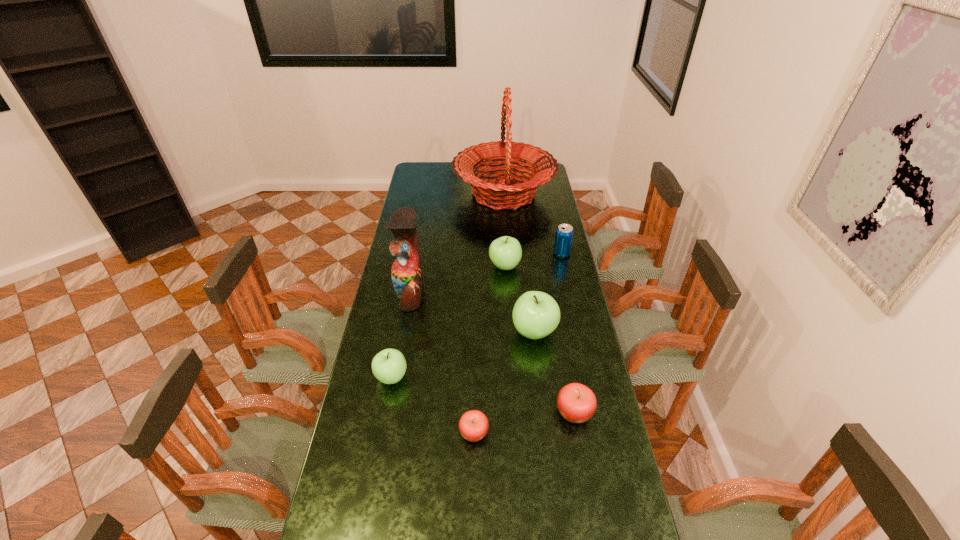
Image resolution: width=960 pixels, height=540 pixels. Identify the location of vacant position located 0.200m on the left of the smaller red apple. (393, 433).

Where is `object located in the far edge section of the desktop`? Image resolution: width=960 pixels, height=540 pixels. object located in the far edge section of the desktop is located at coordinates (504, 195).

Locate an element on the screen. The image size is (960, 540). parrot that is at the left edge is located at coordinates (406, 272).

Where is `apple situated at the left edge`? apple situated at the left edge is located at coordinates coord(389,366).

Where is `basket at the right edge`? The height and width of the screenshot is (540, 960). basket at the right edge is located at coordinates (x=504, y=195).

The image size is (960, 540). I want to click on pop soda present at the right edge, so click(x=564, y=233).

This screenshot has height=540, width=960. I want to click on object situated at the far right corner, so click(504, 195).

Locate an element on the screen. vacant area at the left edge of the desktop is located at coordinates (359, 474).

In the image, there is a desktop. At what (x,y) coordinates should I click in order to perform the action: click on vacant space at the right edge. Please return your answer as a coordinate pair (x, y). This screenshot has width=960, height=540. Looking at the image, I should click on (540, 224).

Locate an element on the screen. vacant region at the far left corner is located at coordinates (433, 165).